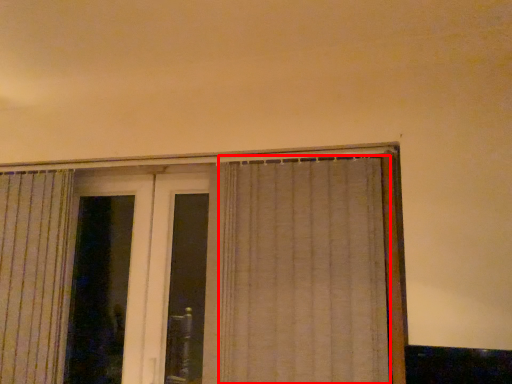
Question: In this image, where is curtain (annotated by the red box) located relative to screen door?

Choices:
 (A) left
 (B) right

Answer: (B)